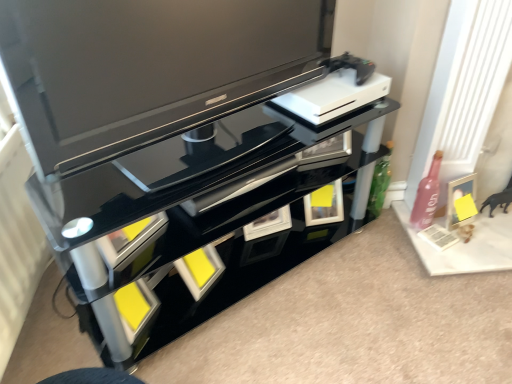
Question: Does matte black tv at upper center have a lesser height compared to matte silver picture frame at right?

Choices:
 (A) yes
 (B) no

Answer: (B)

Question: Considering the relative positions of matte black tv at upper center and matte silver picture frame at right in the image provided, is matte black tv at upper center in front of matte silver picture frame at right?

Choices:
 (A) yes
 (B) no

Answer: (A)

Question: Can you confirm if matte black tv at upper center is taller than matte silver picture frame at right?

Choices:
 (A) no
 (B) yes

Answer: (B)

Question: Can you confirm if matte black tv at upper center is thinner than matte silver picture frame at right?

Choices:
 (A) yes
 (B) no

Answer: (B)

Question: From the image's perspective, is matte black tv at upper center on matte silver picture frame at right?

Choices:
 (A) yes
 (B) no

Answer: (A)

Question: Considering the relative sizes of matte black tv at upper center and matte silver picture frame at right in the image provided, is matte black tv at upper center bigger than matte silver picture frame at right?

Choices:
 (A) yes
 (B) no

Answer: (A)

Question: From the image's perspective, does matte black tv at upper center appear higher than pink glass bottle at right?

Choices:
 (A) yes
 (B) no

Answer: (A)

Question: Considering the relative sizes of matte black tv at upper center and pink glass bottle at right in the image provided, is matte black tv at upper center smaller than pink glass bottle at right?

Choices:
 (A) yes
 (B) no

Answer: (B)

Question: From a real-world perspective, is matte black tv at upper center on top of pink glass bottle at right?

Choices:
 (A) no
 (B) yes

Answer: (B)

Question: Is matte black tv at upper center not inside pink glass bottle at right?

Choices:
 (A) yes
 (B) no

Answer: (A)

Question: From the image's perspective, is matte black tv at upper center located beneath pink glass bottle at right?

Choices:
 (A) yes
 (B) no

Answer: (B)

Question: Is matte black tv at upper center placed right next to pink glass bottle at right?

Choices:
 (A) yes
 (B) no

Answer: (B)

Question: Considering the relative sizes of matte silver picture frame at right and pink glass bottle at right in the image provided, is matte silver picture frame at right thinner than pink glass bottle at right?

Choices:
 (A) yes
 (B) no

Answer: (A)